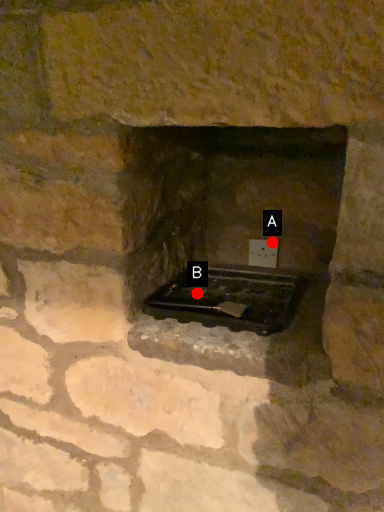
Question: Two points are circled on the image, labeled by A and B beside each circle. Which point is closer to the camera?

Choices:
 (A) A is closer
 (B) B is closer

Answer: (B)